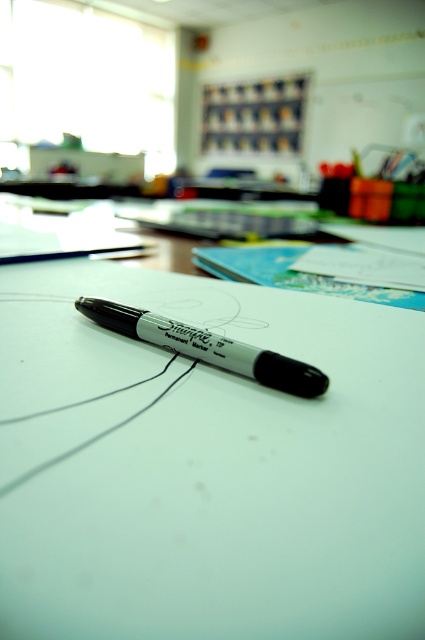
Does white paper at center appear on the left side of black marker pen at center?

In fact, white paper at center is to the right of black marker pen at center.

Can you confirm if white paper at center is positioned above black marker pen at center?

Yes, white paper at center is above black marker pen at center.

Between point (266, 586) and point (291, 362), which one is positioned in front?

Point (266, 586) is in front.

Identify the location of white paper at center. (206, 467).